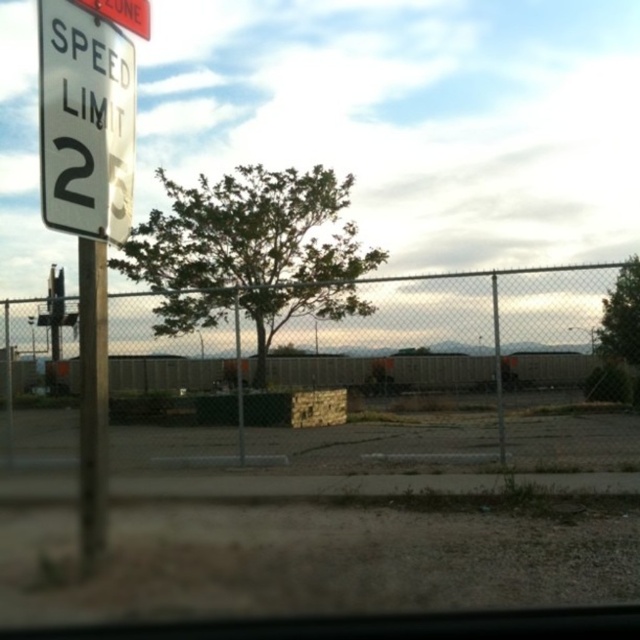
You are inside a car and looking through the window. There are two points marked on the window at coordinates point (221, 372) and point (81, 364). If you want to touch the point that is closer to your hand, which coordinate should you reach for?

You should reach for point (81, 364) because it is closer to you than point (221, 372), which is further away.